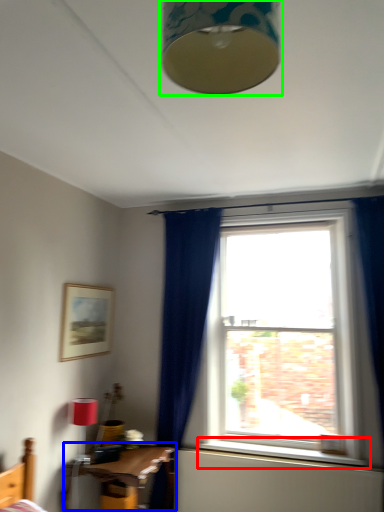
Question: Estimate the real-world distances between objects in this image. Which object is farther from window sill (highlighted by a red box), table (highlighted by a blue box) or lamp (highlighted by a green box)?

Choices:
 (A) table
 (B) lamp

Answer: (B)